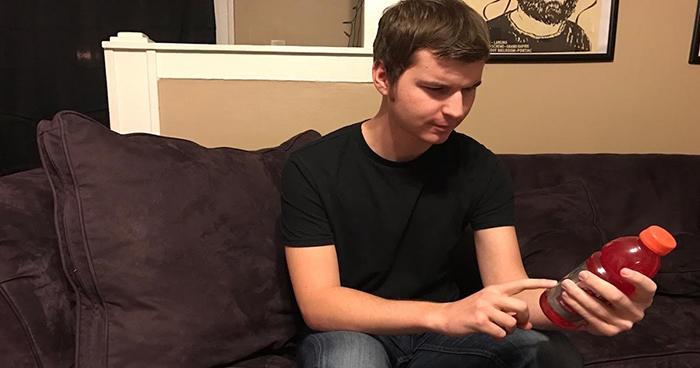
You are a GUI agent. You are given a task and a screenshot of the screen. Output one action in this format:
    pyautogui.click(x=<x>, y=<y>)
    Task: Click on the top of light switch on wall
    This screenshot has width=700, height=368.
    Given the screenshot: What is the action you would take?
    pyautogui.click(x=276, y=41)